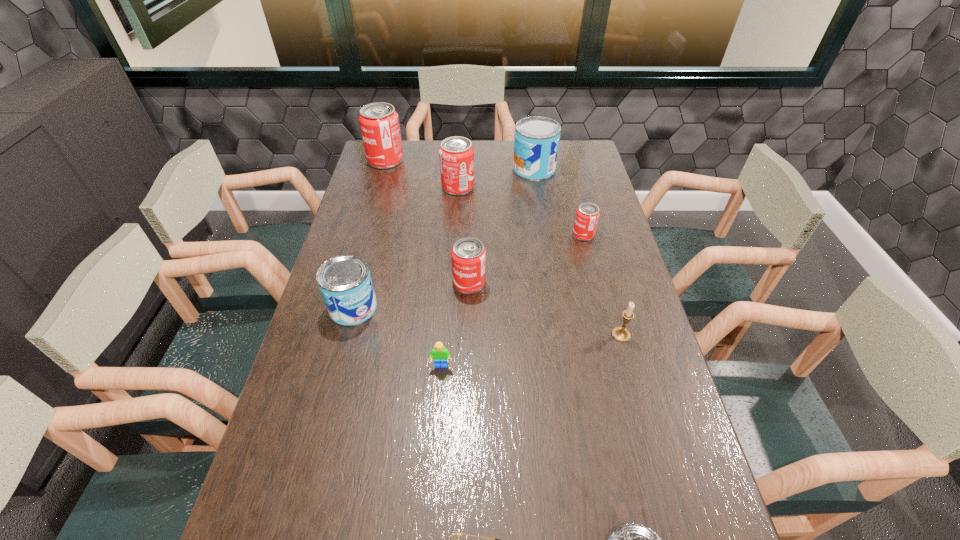
You are a GUI agent. You are given a task and a screenshot of the screen. Output one action in this format:
    pyautogui.click(x=<x>, y=<y>)
    Task: Click on the second shortest object
    Image resolution: width=960 pixels, height=540 pixels.
    Given the screenshot: What is the action you would take?
    pyautogui.click(x=440, y=354)

At what (x,y) coordinates should I click in order to perform the action: click on green Lego. Please return your answer as a coordinate pair (x, y). Looking at the image, I should click on (440, 354).

At what (x,y) coordinates should I click in order to perform the action: click on vacant space located 0.090m on the front of the farthest blue can. Please return your answer as a coordinate pair (x, y). Looking at the image, I should click on (538, 194).

Image resolution: width=960 pixels, height=540 pixels. I want to click on free space located on the back of the third nearest red can, so click(461, 145).

You are a GUI agent. You are given a task and a screenshot of the screen. Output one action in this format:
    pyautogui.click(x=<x>, y=<y>)
    Task: Click on the vacant region located on the front of the second nearest blue can
    
    Given the screenshot: What is the action you would take?
    pyautogui.click(x=333, y=384)

Locate an element on the screen. Image resolution: width=960 pixels, height=540 pixels. free space located on the left of the second smallest red can is located at coordinates (413, 283).

Where is `vacant space located on the back of the candle holder`? This screenshot has height=540, width=960. vacant space located on the back of the candle holder is located at coordinates (593, 235).

I want to click on vacant space located on the back of the fourth nearest can, so click(x=570, y=181).

Where is `vacant space located 0.230m on the face of the eighth farthest object`? vacant space located 0.230m on the face of the eighth farthest object is located at coordinates (434, 462).

Find the location of `candle holder present at the right edge`. candle holder present at the right edge is located at coordinates (621, 334).